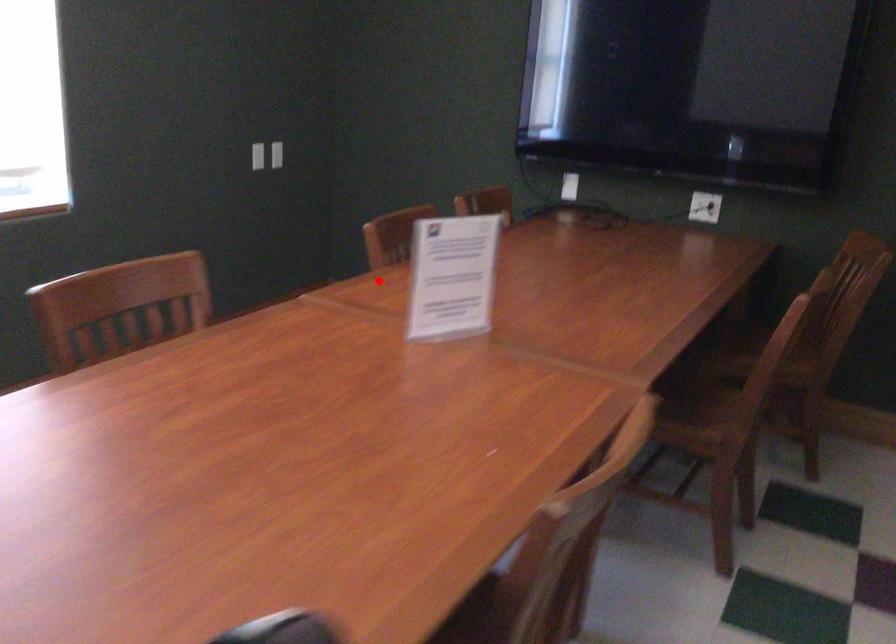
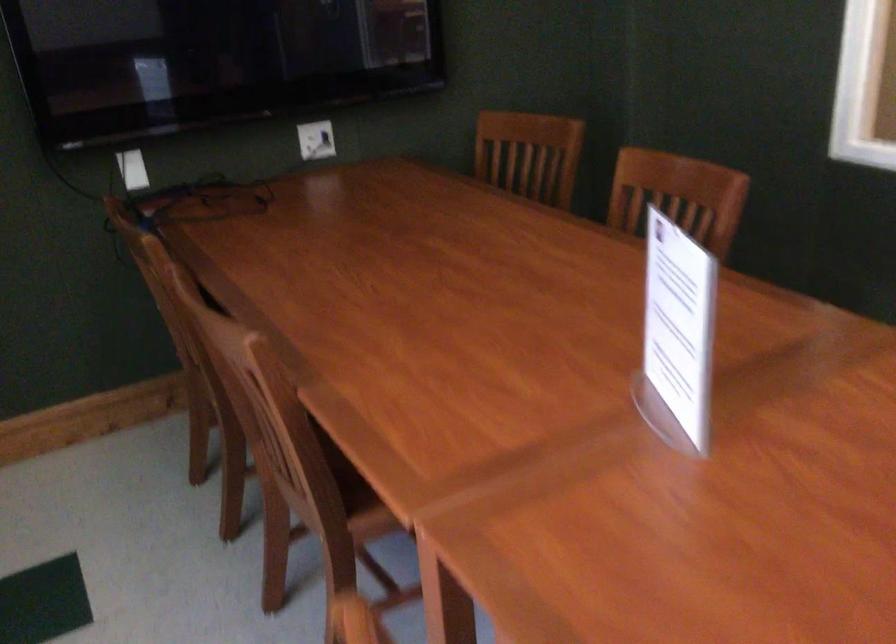
Question: I am providing you with two images of the same scene from different viewpoints. Given a red point in image1, look at the same physical point in image2. Is it:

Choices:
 (A) Closer to the viewpoint
 (B) Farther from the viewpoint

Answer: (A)